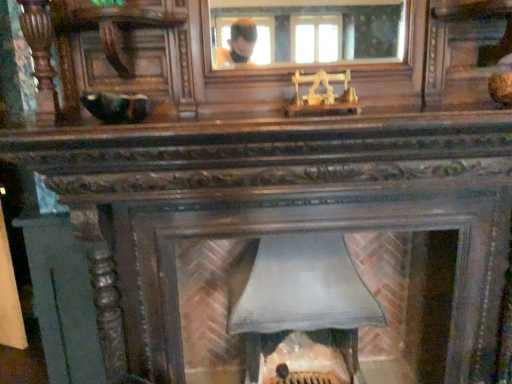
Question: From the image's perspective, relative to clear glass mirror at upper center, is smooth gray stone fireplace at center above or below?

Choices:
 (A) above
 (B) below

Answer: (B)

Question: From a real-world perspective, is smooth gray stone fireplace at center above or below clear glass mirror at upper center?

Choices:
 (A) below
 (B) above

Answer: (A)

Question: Considering the positions of point (414, 266) and point (271, 61), is point (414, 266) closer or farther from the camera than point (271, 61)?

Choices:
 (A) closer
 (B) farther

Answer: (A)

Question: From a real-world perspective, is clear glass mirror at upper center physically located above or below smooth gray stone fireplace at center?

Choices:
 (A) below
 (B) above

Answer: (B)

Question: From their relative heights in the image, would you say clear glass mirror at upper center is taller or shorter than smooth gray stone fireplace at center?

Choices:
 (A) short
 (B) tall

Answer: (A)

Question: Choose the correct answer: Is clear glass mirror at upper center inside smooth gray stone fireplace at center or outside it?

Choices:
 (A) outside
 (B) inside

Answer: (A)

Question: Considering the relative positions of clear glass mirror at upper center and smooth gray stone fireplace at center in the image provided, is clear glass mirror at upper center to the left or to the right of smooth gray stone fireplace at center?

Choices:
 (A) left
 (B) right

Answer: (A)